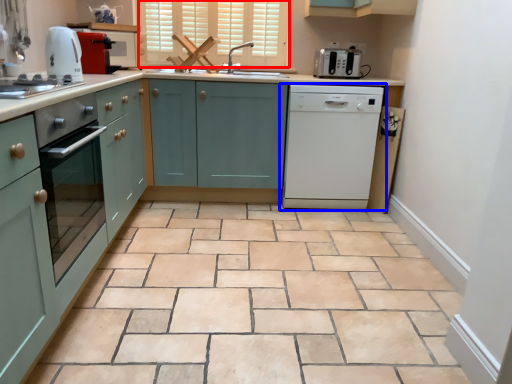
Question: Which point is closer to the camera, window (highlighted by a red box) or home appliance (highlighted by a blue box)?

Choices:
 (A) window
 (B) home appliance

Answer: (B)